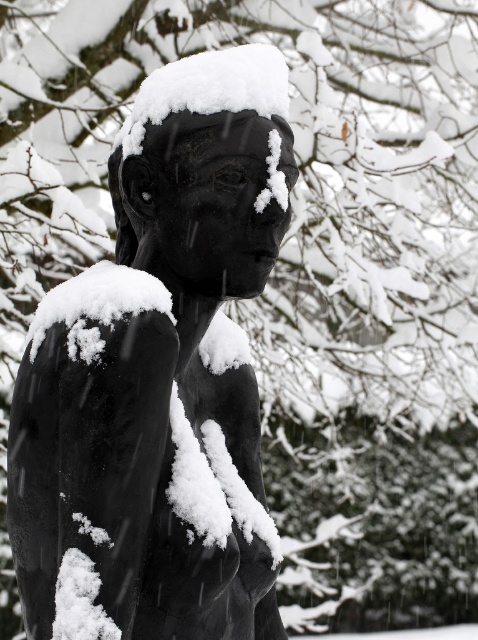
Is matte black statue at center thinner than white fluffy snow at center?

No.

What do you see at coordinates (159, 378) in the screenshot? I see `matte black statue at center` at bounding box center [159, 378].

Between point (276, 68) and point (122, 125), which one is positioned in front?

Point (276, 68)

Locate an element on the screen. The width and height of the screenshot is (478, 640). matte black statue at center is located at coordinates (159, 378).